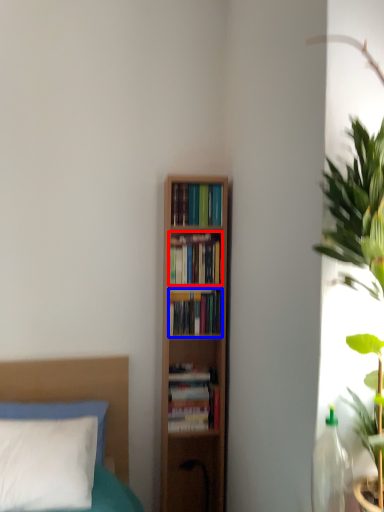
Question: Among these objects, which one is nearest to the camera, book (highlighted by a red box) or book (highlighted by a blue box)?

Choices:
 (A) book
 (B) book

Answer: (A)